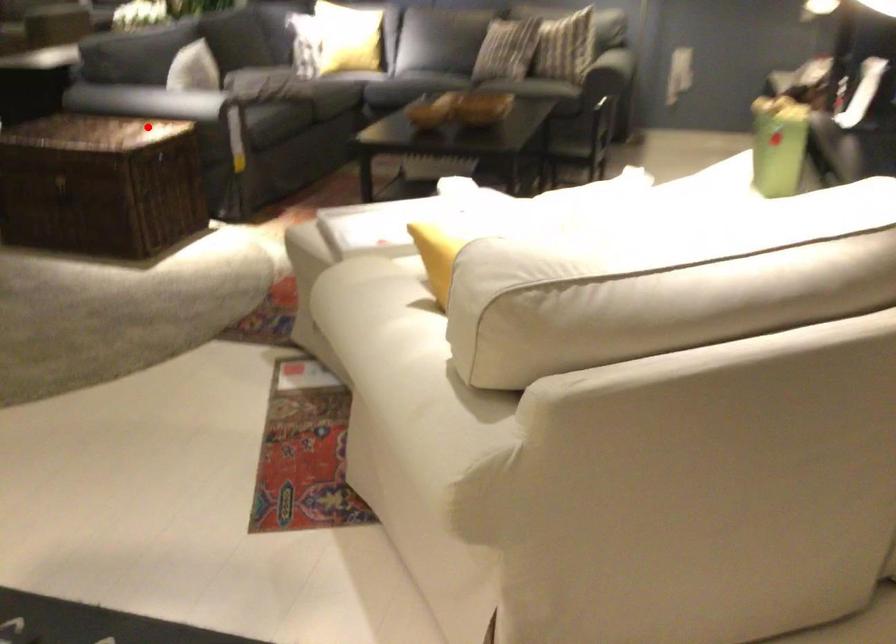
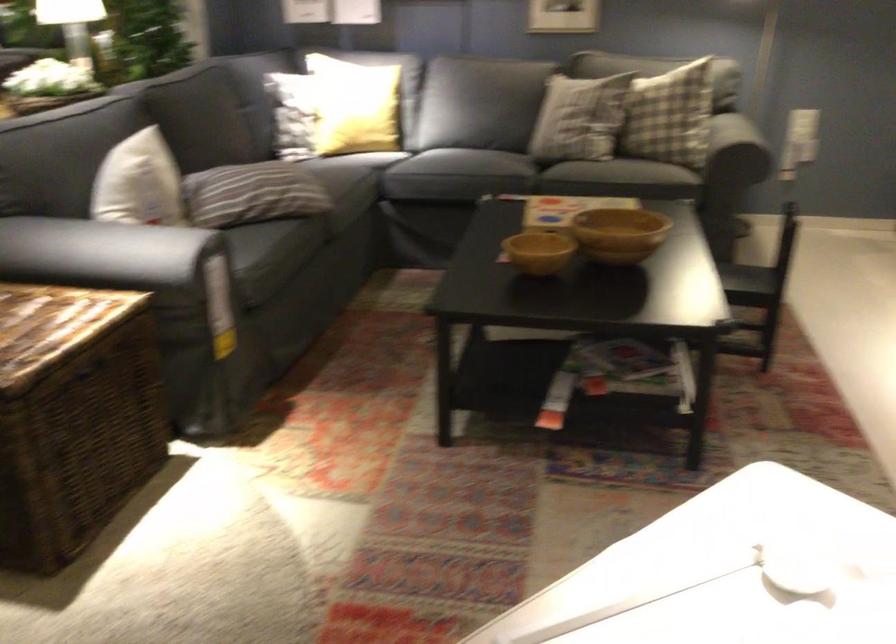
Question: A red point is marked in image1. In image2, is the corresponding 3D point closer to the camera or farther? Reply with the corresponding letter.

Choices:
 (A) The corresponding 3D point is closer.
 (B) The corresponding 3D point is farther.

Answer: (A)